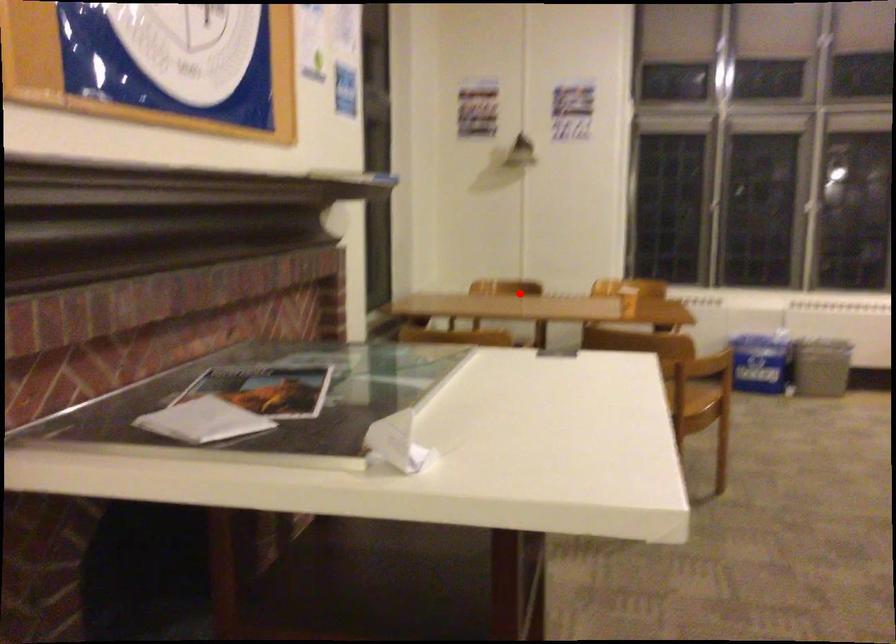
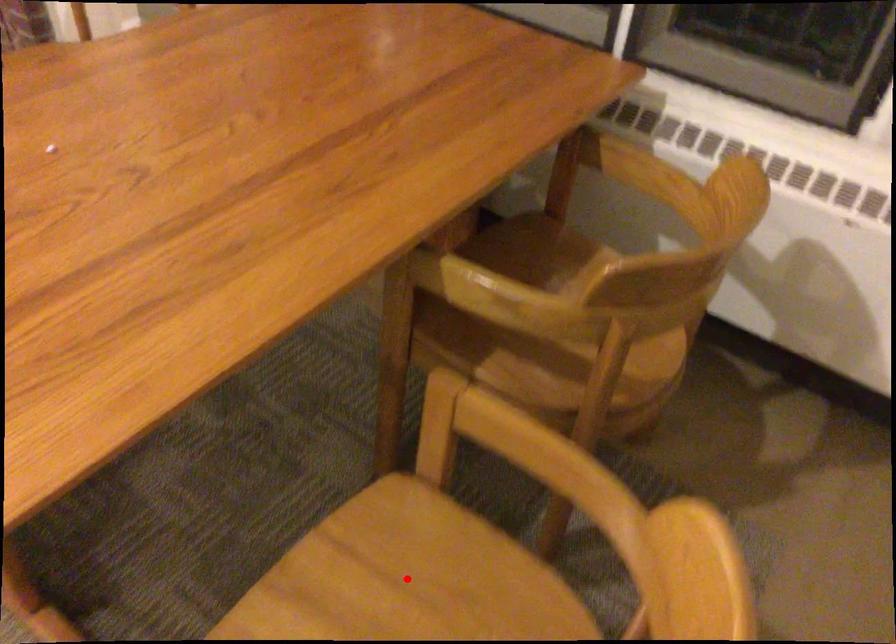
I am providing you with two images of the same scene from different viewpoints. A red point is marked on the first image and another point is marked on the second image. Is the red point in image1 aligned with the point shown in image2?

No